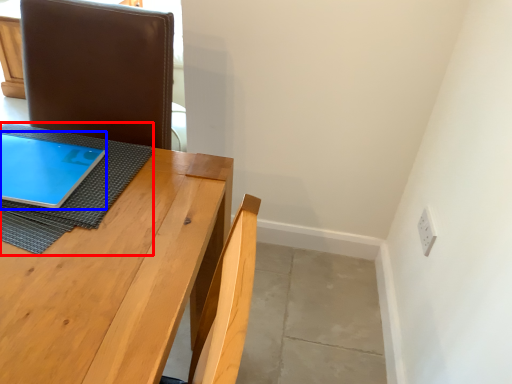
Question: Among these objects, which one is nearest to the camera, cloth (highlighted by a red box) or tablet computer (highlighted by a blue box)?

Choices:
 (A) cloth
 (B) tablet computer

Answer: (A)